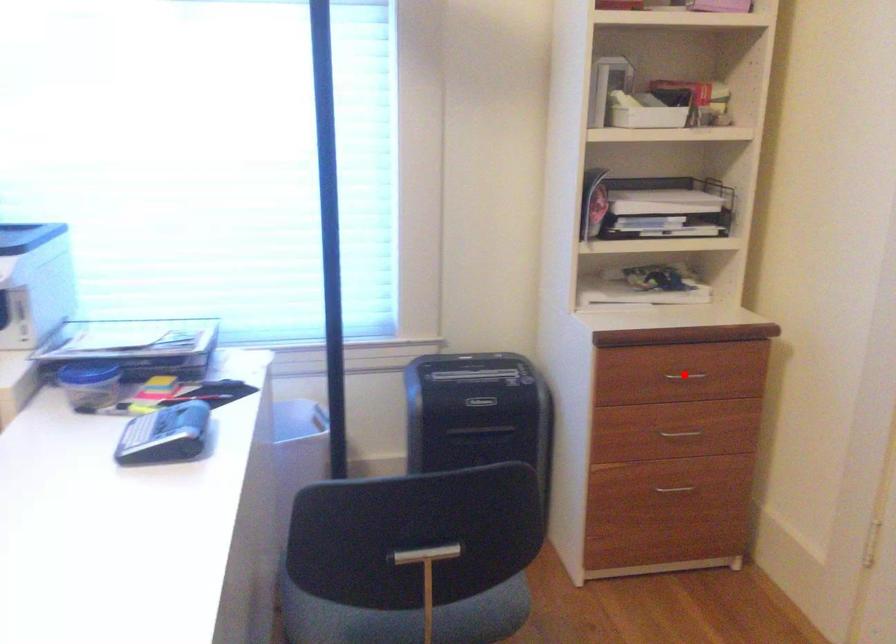
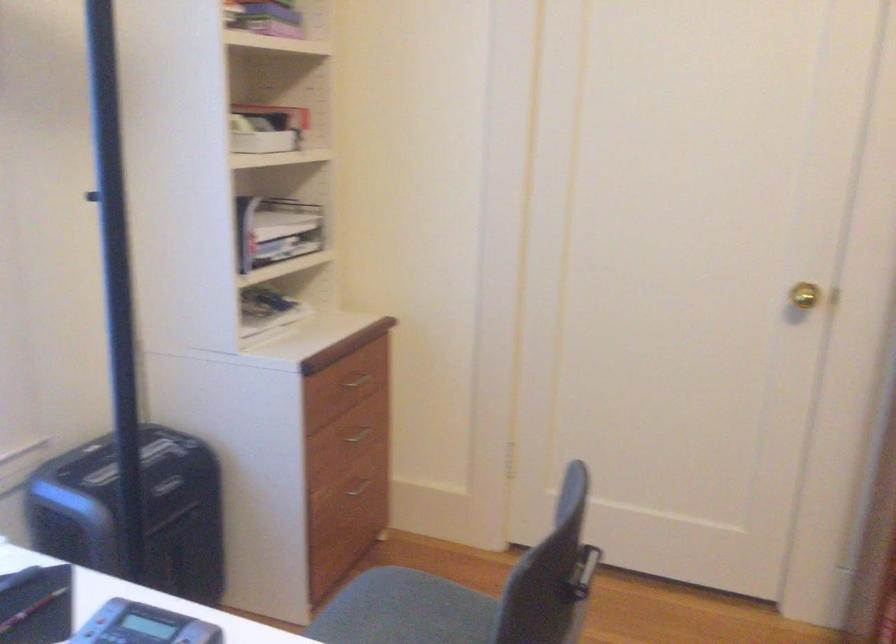
In the second image, find the point that corresponds to the highlighted location in the first image.

(356, 381)